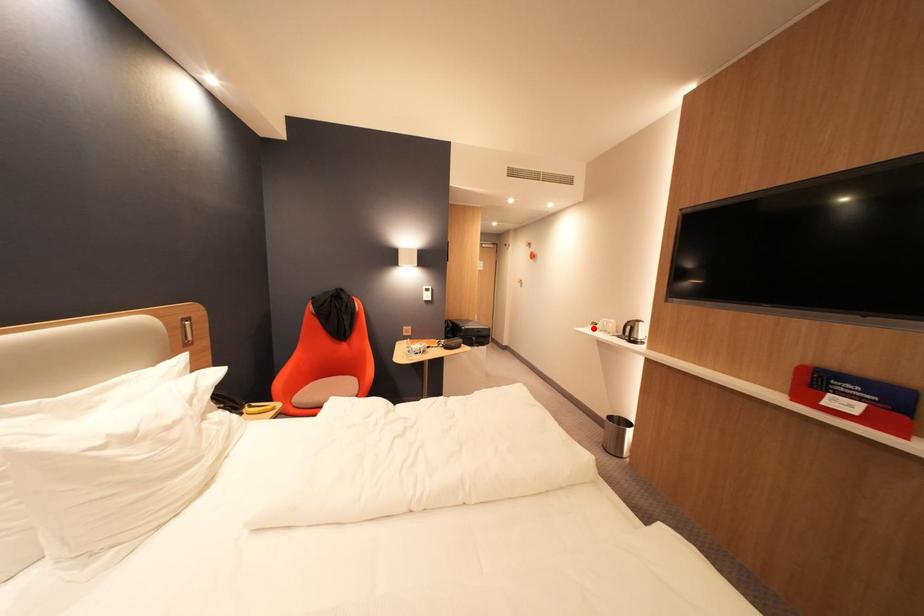
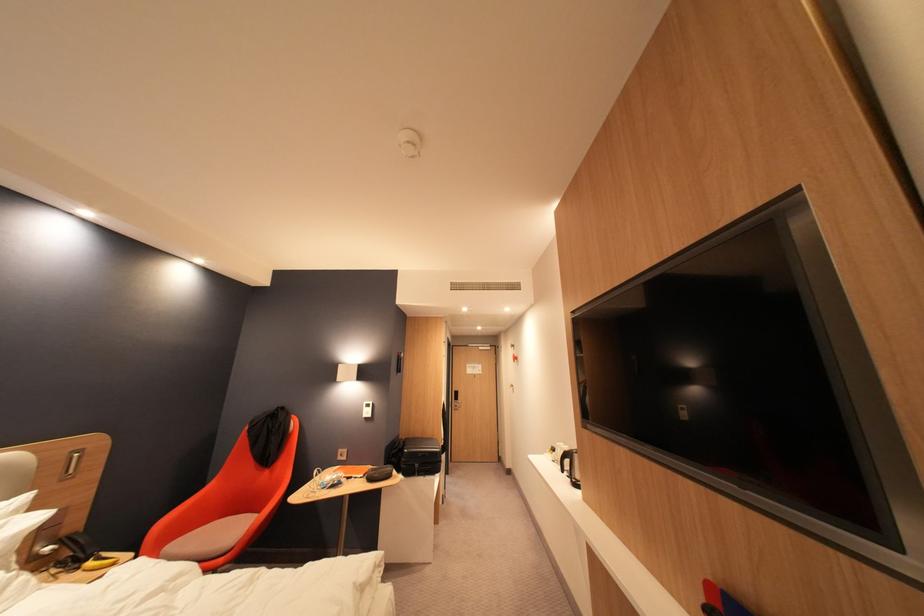
Question: I am providing you with two images of the same scene from different viewpoints. A red point is marked on the first image. At the location where the point appears in image 1, is it still visible in image 2?

Choices:
 (A) Yes
 (B) No

Answer: (A)